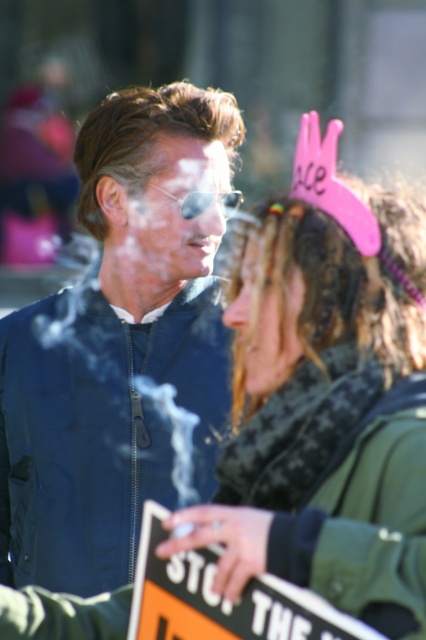
Question: Can you confirm if matte blue jacket at center is positioned to the right of green textured scarf at center?

Choices:
 (A) no
 (B) yes

Answer: (A)

Question: Which point is farther from the camera taking this photo?

Choices:
 (A) (328, 285)
 (B) (281, 296)

Answer: (B)

Question: From the image, what is the correct spatial relationship of matte blue jacket at center in relation to brown shiny hair at upper center?

Choices:
 (A) below
 (B) above

Answer: (A)

Question: Which is farther from the matte blue jacket at center?

Choices:
 (A) brown shiny hair at upper center
 (B) curly brown hair at center
 (C) green textured scarf at center

Answer: (C)

Question: Which point is farther to the camera?

Choices:
 (A) (198, 205)
 (B) (328, 276)

Answer: (A)

Question: Does green textured scarf at center appear on the right side of brown shiny hair at upper center?

Choices:
 (A) no
 (B) yes

Answer: (B)